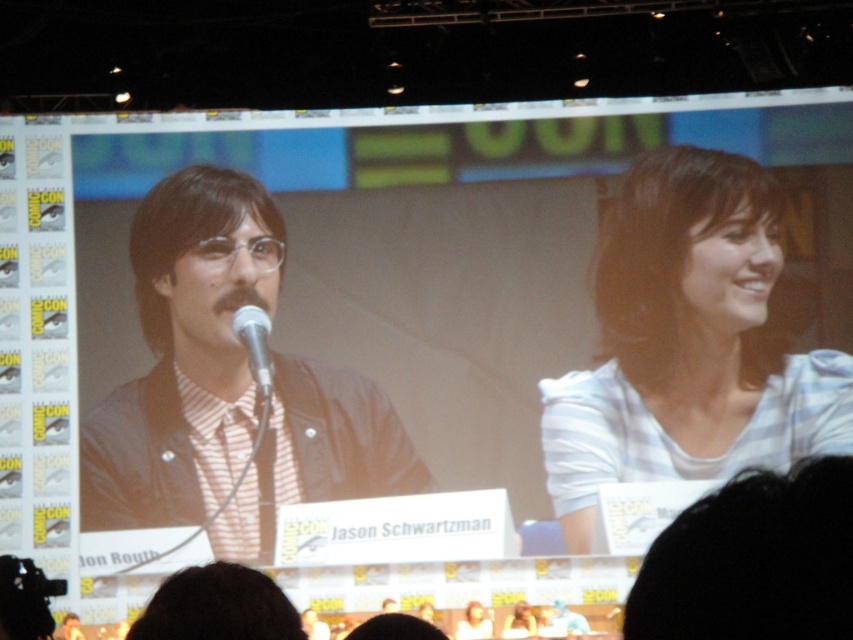
Can you confirm if matte black jacket at left is positioned to the right of silver metallic microphone at center?

Correct, you'll find matte black jacket at left to the right of silver metallic microphone at center.

Can you confirm if matte black jacket at left is bigger than silver metallic microphone at center?

Yes.

Where is `matte black jacket at left`? Image resolution: width=853 pixels, height=640 pixels. matte black jacket at left is located at coordinates (225, 387).

Who is taller, white striped shirt at upper right or matte black jacket at left?

white striped shirt at upper right is taller.

This screenshot has width=853, height=640. Identify the location of white striped shirt at upper right. (688, 342).

Does white striped shirt at upper right have a greater height compared to silver metallic microphone at center?

Indeed, white striped shirt at upper right has a greater height compared to silver metallic microphone at center.

Does point (612, 476) lie behind point (267, 381)?

Yes.

The image size is (853, 640). Find the location of `white striped shirt at upper right`. white striped shirt at upper right is located at coordinates (688, 342).